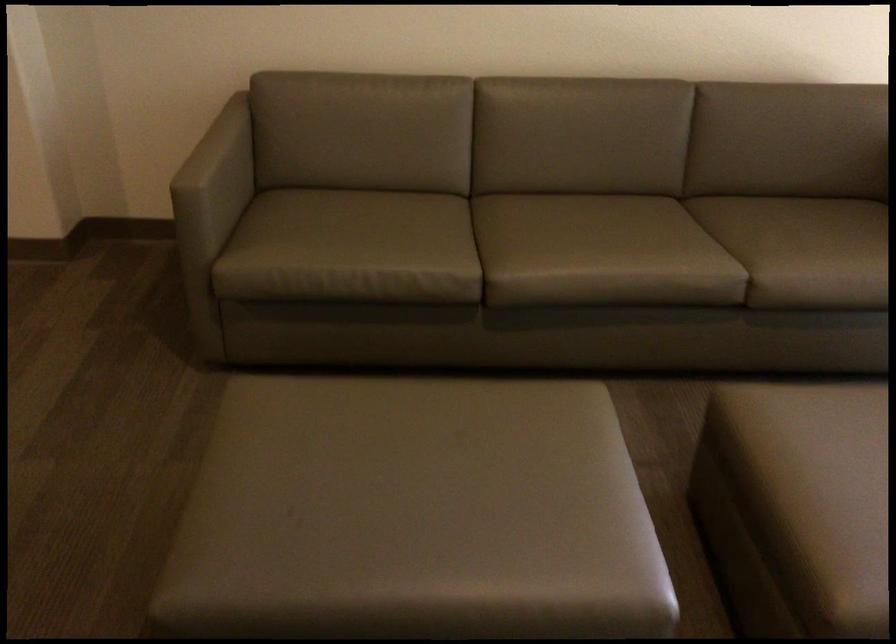
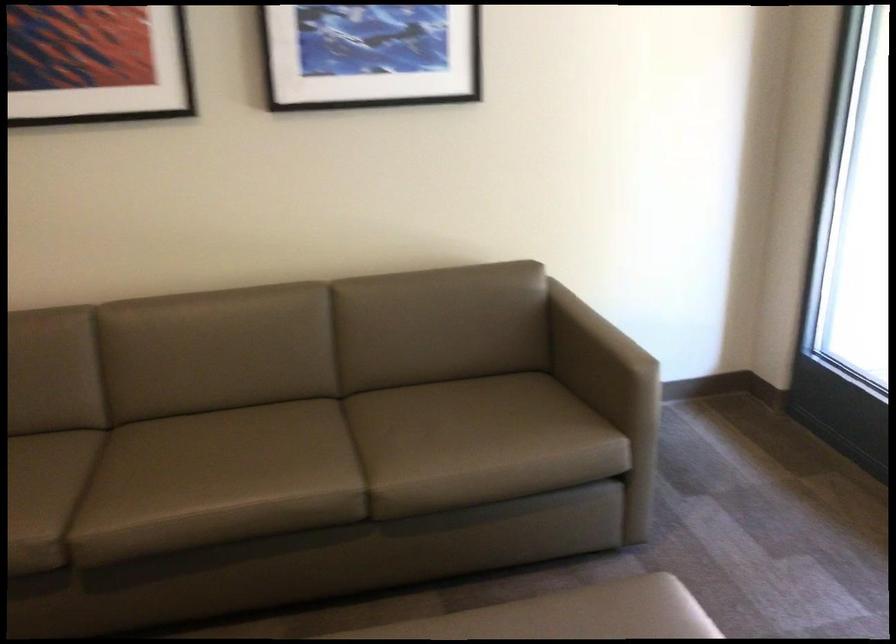
In the second image, find the point that corresponds to point 711,242 in the first image.

(356, 450)